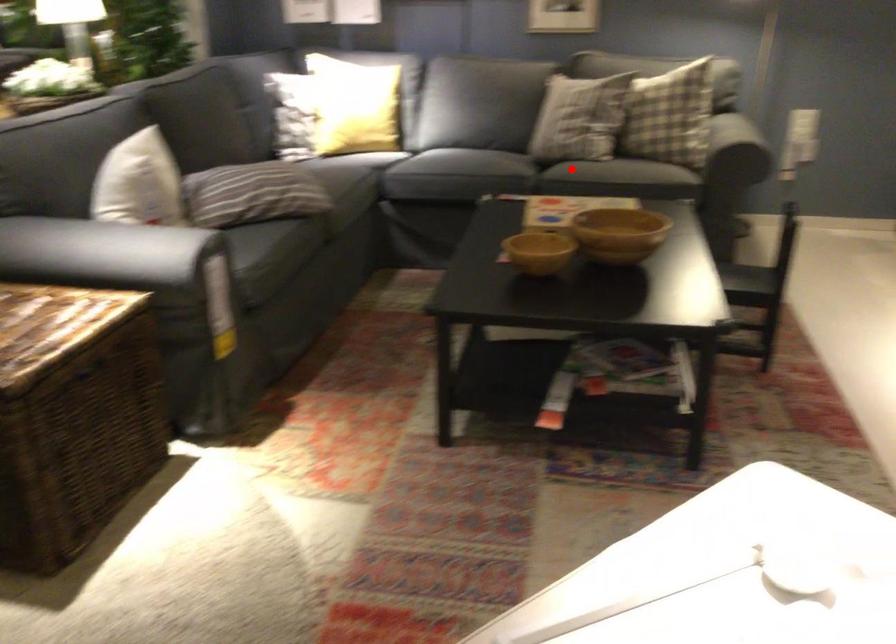
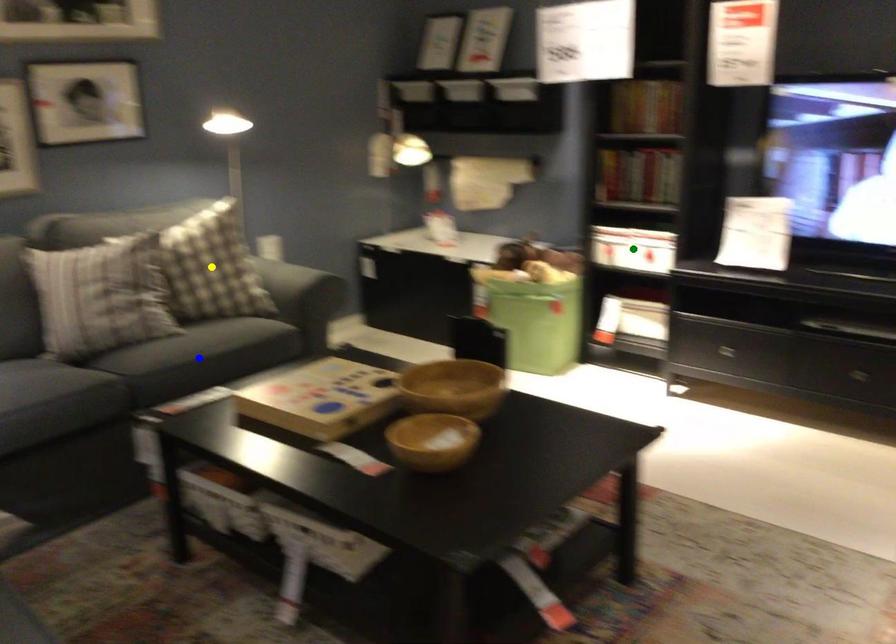
Question: I am providing you with two images of the same scene from different viewpoints. A red point is marked on the first image. You are given multiple points on the second image. Which point in image 2 represents the same 3d spot as the red point in image 1?

Choices:
 (A) yellow point
 (B) blue point
 (C) green point

Answer: (B)